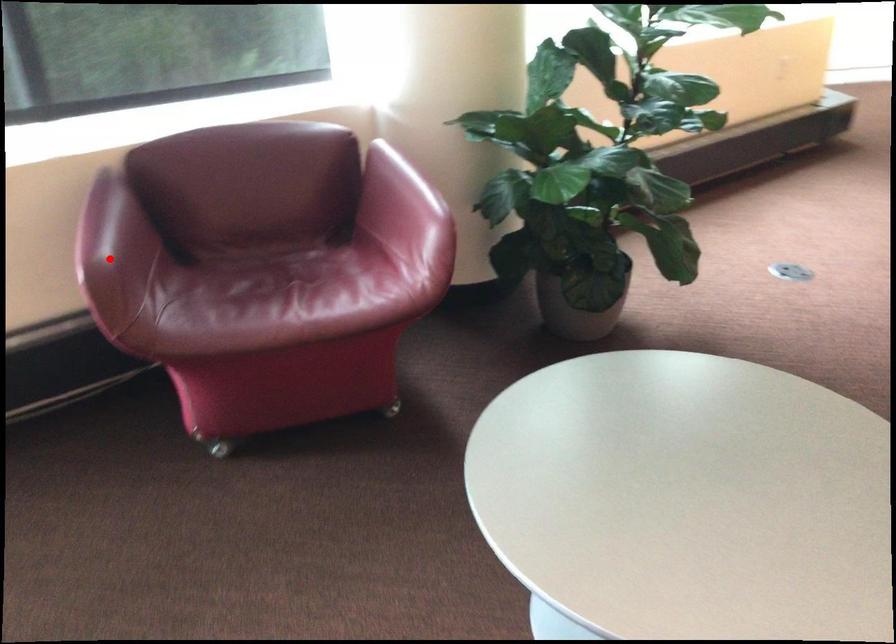
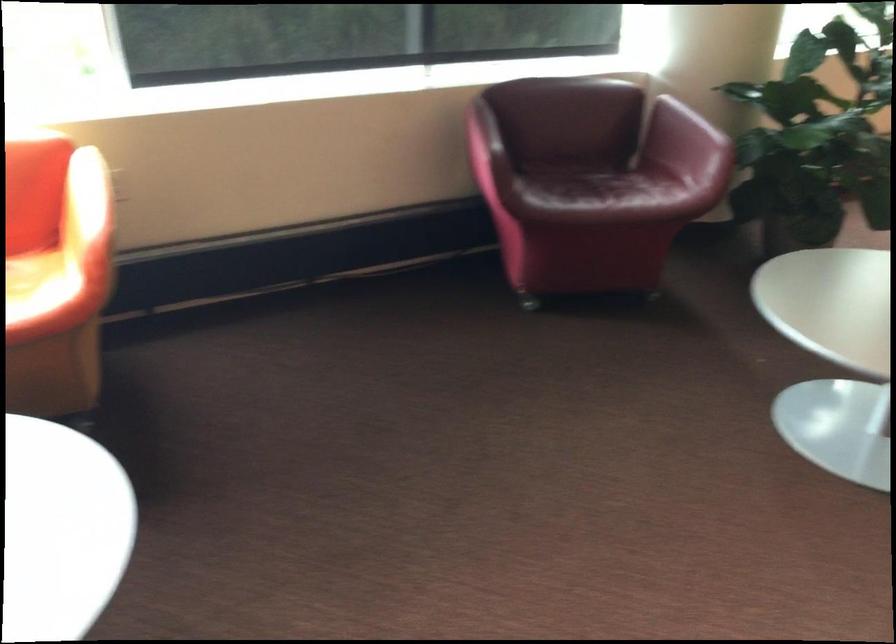
Question: A red point is marked in image1. In image2, is the corresponding 3D point closer to the camera or farther? Reply with the corresponding letter.

Choices:
 (A) The corresponding 3D point is closer.
 (B) The corresponding 3D point is farther.

Answer: (B)